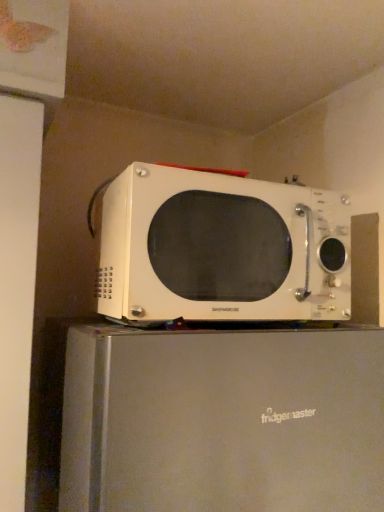
Question: Can you confirm if white matte microwave at upper center is positioned to the right of white matte microwave at center?

Choices:
 (A) no
 (B) yes

Answer: (A)

Question: Is white matte microwave at upper center shorter than white matte microwave at center?

Choices:
 (A) no
 (B) yes

Answer: (A)

Question: Is white matte microwave at upper center not within white matte microwave at center?

Choices:
 (A) yes
 (B) no

Answer: (A)

Question: From a real-world perspective, is white matte microwave at upper center positioned over white matte microwave at center based on gravity?

Choices:
 (A) yes
 (B) no

Answer: (B)

Question: Is the surface of white matte microwave at upper center in direct contact with white matte microwave at center?

Choices:
 (A) no
 (B) yes

Answer: (A)

Question: Can you confirm if white matte microwave at upper center is bigger than white matte microwave at center?

Choices:
 (A) no
 (B) yes

Answer: (B)

Question: Is white matte microwave at center placed right next to white matte microwave at upper center?

Choices:
 (A) no
 (B) yes

Answer: (A)

Question: Is white matte microwave at center at the right side of white matte microwave at upper center?

Choices:
 (A) no
 (B) yes

Answer: (B)

Question: Does white matte microwave at center have a smaller size compared to white matte microwave at upper center?

Choices:
 (A) no
 (B) yes

Answer: (B)

Question: Considering the relative sizes of white matte microwave at center and white matte microwave at upper center in the image provided, is white matte microwave at center wider than white matte microwave at upper center?

Choices:
 (A) no
 (B) yes

Answer: (A)

Question: From the image's perspective, is white matte microwave at center on top of white matte microwave at upper center?

Choices:
 (A) no
 (B) yes

Answer: (B)

Question: Does white matte microwave at center come behind white matte microwave at upper center?

Choices:
 (A) yes
 (B) no

Answer: (A)

Question: Is point (87, 426) positioned closer to the camera than point (256, 229)?

Choices:
 (A) farther
 (B) closer

Answer: (B)